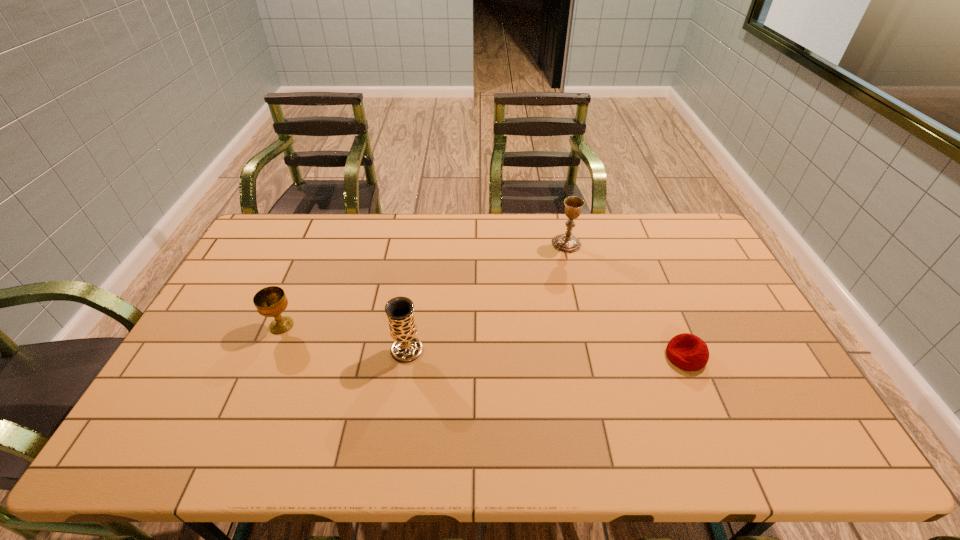
Identify the location of free spot between the shortest object and the second object from right to left. (626, 300).

Where is `empty space that is in between the second shortest object and the second chalice from right to left`? empty space that is in between the second shortest object and the second chalice from right to left is located at coordinates (345, 338).

You are a GUI agent. You are given a task and a screenshot of the screen. Output one action in this format:
    pyautogui.click(x=<x>, y=<y>)
    Task: Click on the blank region between the rightmost object and the farthest object
    The width and height of the screenshot is (960, 540).
    Given the screenshot: What is the action you would take?
    pyautogui.click(x=626, y=300)

I want to click on free spot between the second farthest chalice and the third object from left to right, so click(x=424, y=285).

Identify the location of free space between the farthest chalice and the shortest chalice. (424, 285).

Locate an element on the screen. vacant area that lies between the farthest object and the rightmost object is located at coordinates (626, 300).

Identify the location of free space between the beanbag and the second object from left to right. (x=546, y=353).

Where is `vacant space that's between the beanbag and the second farthest object`? The width and height of the screenshot is (960, 540). vacant space that's between the beanbag and the second farthest object is located at coordinates (x=484, y=341).

At what (x,y) coordinates should I click in order to perform the action: click on unoccupied area between the rightmost object and the second chalice from left to right. Please return your answer as a coordinate pair (x, y). Image resolution: width=960 pixels, height=540 pixels. Looking at the image, I should click on (546, 353).

Find the location of a particular element. vacant area that lies between the second object from left to right and the shortest object is located at coordinates (546, 353).